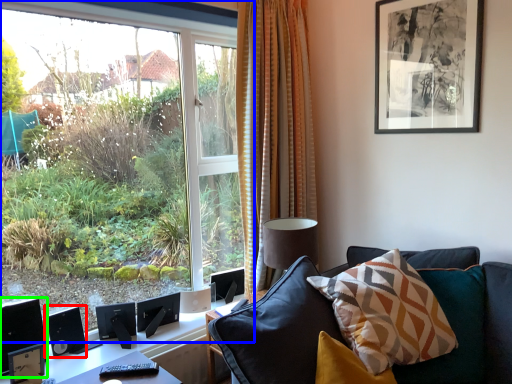
Question: Estimate the real-world distances between objects in this image. Which object is farther from speaker (highlighted by a red box), window (highlighted by a blue box) or computer monitor (highlighted by a green box)?

Choices:
 (A) window
 (B) computer monitor

Answer: (A)